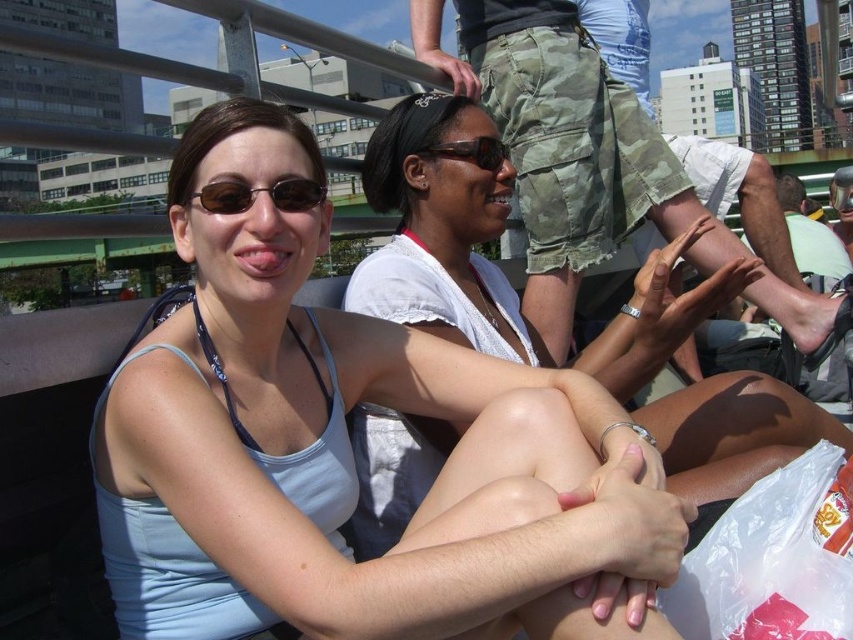
Does point (612, 324) come behind point (479, 138)?

That is True.

Is point (479, 253) behind point (488, 147)?

Yes, it is behind point (488, 147).

This screenshot has width=853, height=640. In order to click on white lace top at center in this screenshot , I will do `click(494, 264)`.

Measure the distance between light blue fabric tank top at center and white lace top at center.

light blue fabric tank top at center and white lace top at center are 15.20 feet apart.

Can you confirm if light blue fabric tank top at center is thinner than white lace top at center?

Indeed, light blue fabric tank top at center has a lesser width compared to white lace top at center.

Is point (380, 371) more distant than point (686, 300)?

No.

The width and height of the screenshot is (853, 640). I want to click on light blue fabric tank top at center, so click(350, 451).

Between point (572, 509) and point (283, 209), which one is positioned in front?

Point (572, 509)

Does light blue fabric tank top at center appear on the right side of matte brown sunglasses at center?

Indeed, light blue fabric tank top at center is positioned on the right side of matte brown sunglasses at center.

This screenshot has width=853, height=640. Find the location of `light blue fabric tank top at center`. light blue fabric tank top at center is located at coordinates (350, 451).

This screenshot has width=853, height=640. Identify the location of light blue fabric tank top at center. (350, 451).